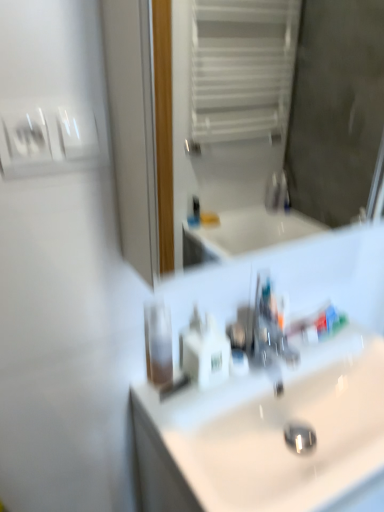
What do you see at coordinates (273, 390) in the screenshot?
I see `white glossy sink at center` at bounding box center [273, 390].

Describe the element at coordinates (204, 351) in the screenshot. I see `white plastic soap dispenser at center` at that location.

The image size is (384, 512). I want to click on white glossy light switch at upper left, so click(47, 139).

Does white glossy sink at center have a greater width compared to white plastic soap dispenser at center?

Yes.

From the image's perspective, is white glossy sink at center positioned above or below white plastic soap dispenser at center?

From the image's perspective, white glossy sink at center appears below white plastic soap dispenser at center.

In the scene shown: Which object is positioned more to the left, white glossy sink at center or white plastic soap dispenser at center?

From the viewer's perspective, white plastic soap dispenser at center appears more on the left side.

Which object is wider, white glossy toothpaste at center or transparent plastic mouthwash at center?

white glossy toothpaste at center is wider.

Considering the sizes of white glossy toothpaste at center and transparent plastic mouthwash at center in the image, is white glossy toothpaste at center taller or shorter than transparent plastic mouthwash at center?

In the image, white glossy toothpaste at center appears to be shorter than transparent plastic mouthwash at center.

Is white glossy toothpaste at center inside the boundaries of transparent plastic mouthwash at center, or outside?

white glossy toothpaste at center lies outside transparent plastic mouthwash at center.

From the image's perspective, which one is positioned lower, white glossy toothpaste at center or transparent plastic mouthwash at center?

transparent plastic mouthwash at center is shown below in the image.

From a real-world perspective, is white glossy mirror at upper center located beneath white plastic soap dispenser at center?

No.

In the scene shown: How far apart are white glossy mirror at upper center and white plastic soap dispenser at center?

white glossy mirror at upper center is 1.64 meters away from white plastic soap dispenser at center.

Which object is further away from the camera, white glossy mirror at upper center or white plastic soap dispenser at center?

white plastic soap dispenser at center is behind.

Based on the photo, which is further, (167, 245) or (228, 346)?

Point (167, 245)

Is white glossy sink at center surrounded by white plastic soap dispenser at center?

No, white plastic soap dispenser at center does not contain white glossy sink at center.

Is white plastic soap dispenser at center facing away from white glossy sink at center?

No.

How many degrees apart are the facing directions of white plastic soap dispenser at center and white glossy sink at center?

There is a 0.746-degree angle between the facing directions of white plastic soap dispenser at center and white glossy sink at center.

Can you confirm if white glossy mirror at upper center is wider than white glossy light switch at upper left?

Indeed, white glossy mirror at upper center has a greater width compared to white glossy light switch at upper left.

From their relative heights in the image, would you say white glossy mirror at upper center is taller or shorter than white glossy light switch at upper left?

Clearly, white glossy mirror at upper center is taller compared to white glossy light switch at upper left.

From the image's perspective, is white glossy mirror at upper center below white glossy light switch at upper left?

Actually, white glossy mirror at upper center appears above white glossy light switch at upper left in the image.

Considering the positions of point (332, 360) and point (174, 87), is point (332, 360) closer or farther from the camera than point (174, 87)?

Point (332, 360).

Is white glossy sink at center placed right next to white glossy mirror at upper center?

They are not placed beside each other.

Who is bigger, white glossy sink at center or white glossy mirror at upper center?

With larger size is white glossy mirror at upper center.

What's the angular difference between white plastic soap dispenser at center and transparent plastic mouthwash at center's facing directions?

The angle between the facing direction of white plastic soap dispenser at center and the facing direction of transparent plastic mouthwash at center is 3.87 degrees.

Is white plastic soap dispenser at center positioned far away from transparent plastic mouthwash at center?

That's not correct — white plastic soap dispenser at center is a little close to transparent plastic mouthwash at center.

Is white plastic soap dispenser at center to the left of transparent plastic mouthwash at center from the viewer's perspective?

Incorrect, white plastic soap dispenser at center is not on the left side of transparent plastic mouthwash at center.

Is white plastic soap dispenser at center completely or partially outside of transparent plastic mouthwash at center?

Yes, white plastic soap dispenser at center is not within transparent plastic mouthwash at center.

You are a GUI agent. You are given a task and a screenshot of the screen. Output one action in this format:
    pyautogui.click(x=<x>, y=<y>)
    Task: Click on the sink that is below the white plastic soap dispenser at center (from the image's perspective)
    This screenshot has width=384, height=512.
    Given the screenshot: What is the action you would take?
    pyautogui.click(x=273, y=390)

I want to click on toothpaste that is on the right side of transparent plastic mouthwash at center, so click(318, 323).

When comparing their distances from white plastic soap dispenser at center, does white glossy mirror at upper center or white glossy toothpaste at center seem closer?

Based on the image, white glossy toothpaste at center appears to be nearer to white plastic soap dispenser at center.

Considering their positions, is white glossy toothpaste at center positioned further to white glossy light switch at upper left than white glossy sink at center?

white glossy toothpaste at center is positioned further to the anchor white glossy light switch at upper left.

Estimate the real-world distances between objects in this image. Which object is further from transparent plastic mouthwash at center, white glossy toothpaste at center or white glossy light switch at upper left?

white glossy light switch at upper left.

When comparing their distances from transparent plastic mouthwash at center, does white glossy sink at center or white glossy light switch at upper left seem further?

white glossy light switch at upper left.

From the picture: Looking at the image, which one is located closer to transparent plastic mouthwash at center, white glossy light switch at upper left or white glossy sink at center?

white glossy sink at center.

From the image, which object appears to be farther from white plastic soap dispenser at center, white glossy toothpaste at center or white glossy sink at center?

Based on the image, white glossy toothpaste at center appears to be further to white plastic soap dispenser at center.

When comparing their distances from transparent plastic mouthwash at center, does white glossy light switch at upper left or white glossy mirror at upper center seem closer?

white glossy light switch at upper left.

Estimate the real-world distances between objects in this image. Which object is further from white glossy mirror at upper center, white glossy light switch at upper left or white glossy toothpaste at center?

white glossy light switch at upper left is positioned further to the anchor white glossy mirror at upper center.

The height and width of the screenshot is (512, 384). In order to click on mouthwash situated between white glossy light switch at upper left and white glossy toothpaste at center from left to right in this screenshot , I will do `click(158, 343)`.

You are a GUI agent. You are given a task and a screenshot of the screen. Output one action in this format:
    pyautogui.click(x=<x>, y=<y>)
    Task: Click on the mouthwash between white glossy light switch at upper left and white plastic soap dispenser at center in the vertical direction
    The image size is (384, 512).
    Given the screenshot: What is the action you would take?
    pyautogui.click(x=158, y=343)

Locate an element on the screen. The image size is (384, 512). light switch between white glossy mirror at upper center and white glossy toothpaste at center from front to back is located at coordinates (47, 139).

Identify the location of mouthwash that lies between white glossy light switch at upper left and white glossy sink at center from top to bottom. (158, 343).